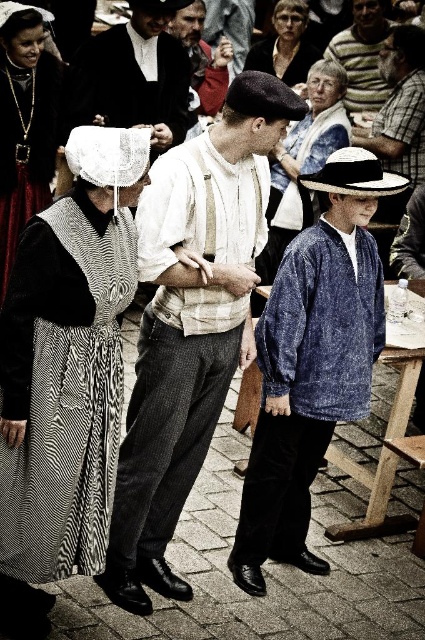
Question: Which point is farther to the camera?

Choices:
 (A) (350, 166)
 (B) (17, 504)
 (C) (357, 20)
 (D) (6, 248)

Answer: (C)

Question: Observing the image, what is the correct spatial positioning of matte white shirt at center in reference to white straw hat at center?

Choices:
 (A) above
 (B) below

Answer: (B)

Question: Does denim shirt at center have a lesser width compared to black velvet dress at center?

Choices:
 (A) no
 (B) yes

Answer: (A)

Question: Which is farther from the black velvet dress at center?

Choices:
 (A) denim shirt at center
 (B) black woolen suit at center

Answer: (A)

Question: Does matte white shirt at center have a larger size compared to denim shirt at center?

Choices:
 (A) yes
 (B) no

Answer: (A)

Question: Which object is positioned closest to the denim shirt at center?

Choices:
 (A) black woolen suit at center
 (B) striped sweater at center
 (C) matte white shirt at center

Answer: (C)